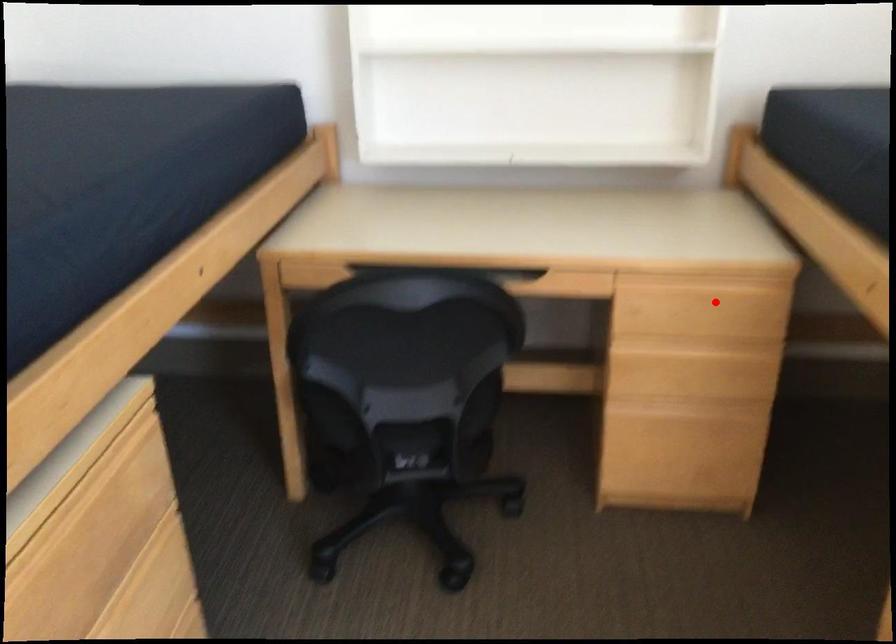
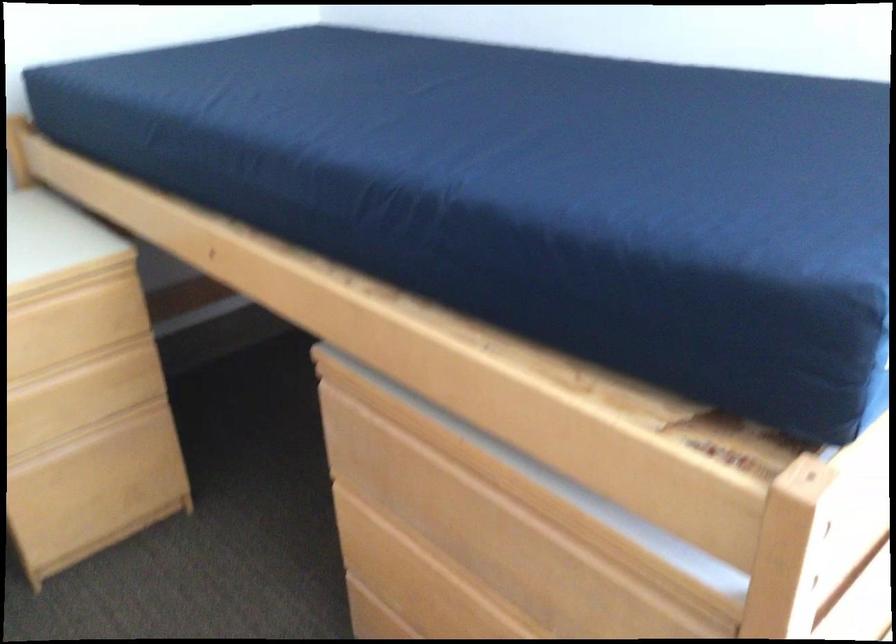
The point at the highlighted location is marked in the first image. Where is the corresponding point in the second image?

(73, 323)